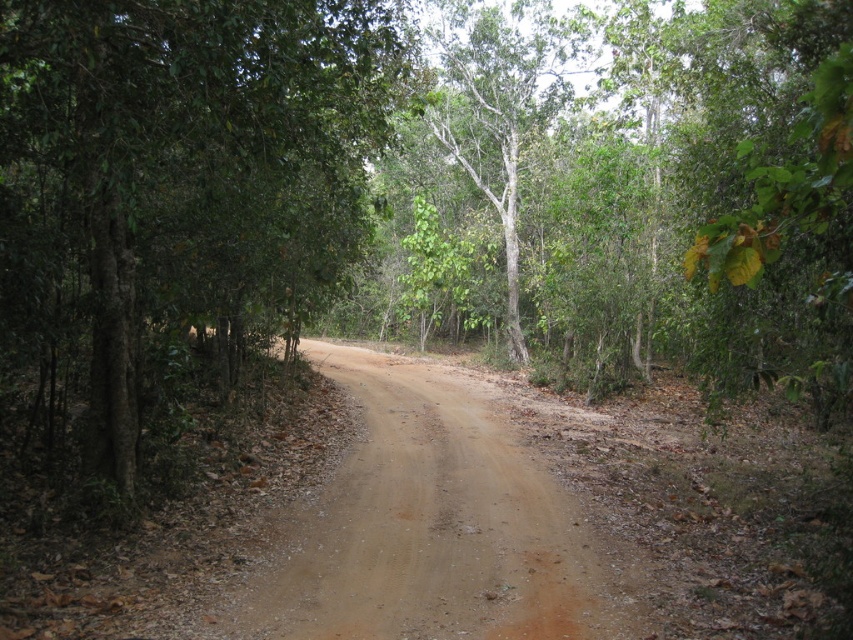
You are driving a large truck that is 3 meters wide. You need to navigate through the narrow dirt road shown in the image. There are two trees blocking your path ahead. The green leafy tree at left and the green matte tree at center. Can you pass through between them without hitting either tree?

The green leafy tree at left is in front of the green matte tree at center, so you can pass through between them as long as the distance between the trees is wider than the truck. However, the description does not provide the exact distance between the trees, so it is uncertain if the truck can pass safely.

You are a hiker trying to navigate the narrow dirt road. You notice the green leafy tree at left and the brown dirt track at center. Which one is wider?

The green leafy tree at left is wider than the brown dirt track at center.